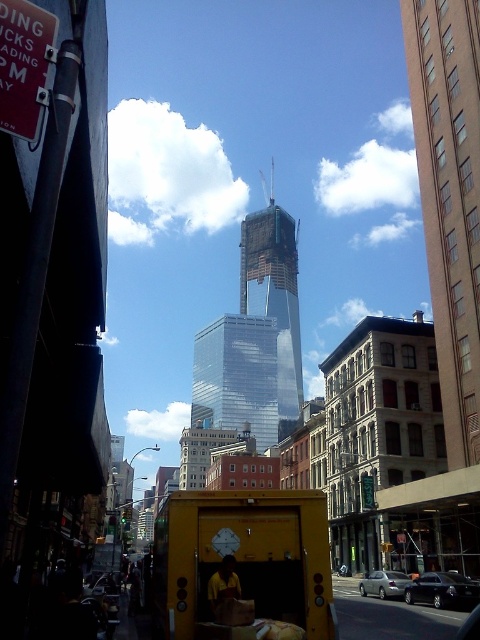
Question: Does glassy steel skyscraper at center lie behind silver metallic sedan at center?

Choices:
 (A) no
 (B) yes

Answer: (B)

Question: Which object appears closest to the camera in this image?

Choices:
 (A) transparent glass skyscraper at center
 (B) glassy steel skyscraper at center
 (C) silver metallic sedan at center

Answer: (C)

Question: Considering the relative positions of yellow matte food truck at center and silver metallic sedan at center in the image provided, where is yellow matte food truck at center located with respect to silver metallic sedan at center?

Choices:
 (A) left
 (B) right

Answer: (A)

Question: Considering the real-world distances, which object is closest to the transparent glass skyscraper at center?

Choices:
 (A) glassy steel skyscraper at center
 (B) brown brick building at upper right
 (C) yellow matte food truck at center
 (D) shiny black sedan at center

Answer: (A)

Question: Which point appears closest to the camera in this image?

Choices:
 (A) (444, 595)
 (B) (469, 120)
 (C) (386, 588)
 (D) (238, 355)

Answer: (A)

Question: Is brown brick building at upper right to the left of shiny black sedan at center from the viewer's perspective?

Choices:
 (A) yes
 (B) no

Answer: (B)